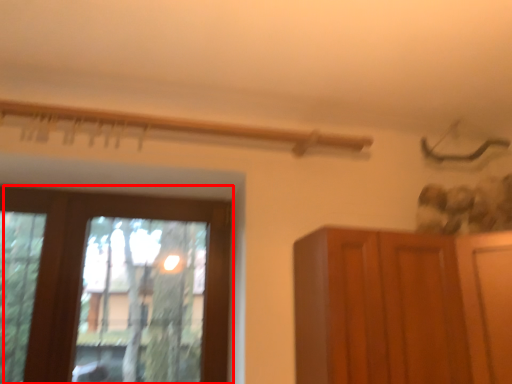
Question: From the image's perspective, considering the relative positions of window (annotated by the red box) and cupboard in the image provided, where is window (annotated by the red box) located with respect to the staircase?

Choices:
 (A) above
 (B) below

Answer: (A)